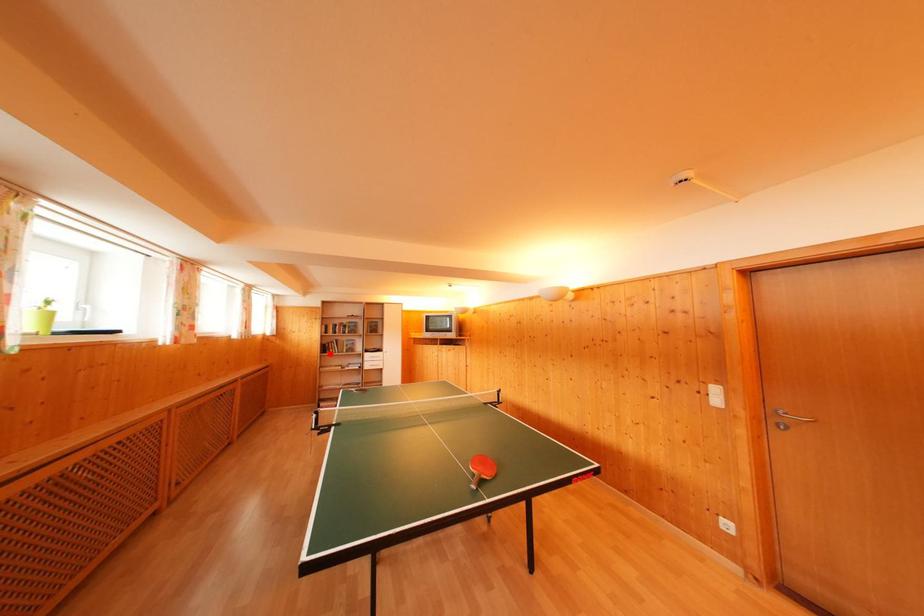
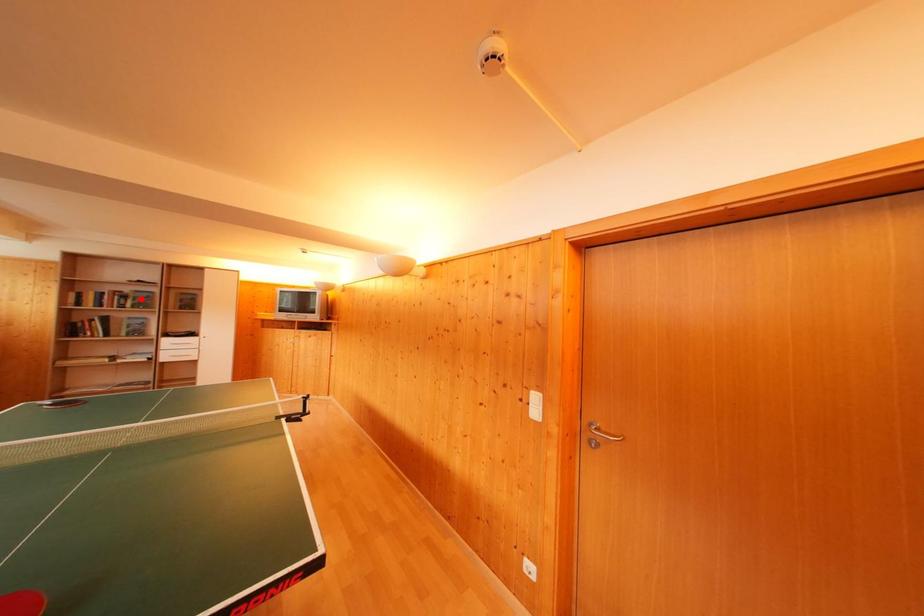
I am providing you with two images of the same scene from different viewpoints. A red point is marked on the first image and another point is marked on the second image. Are the points marked in image1 and image2 representing the same 3D position?

No